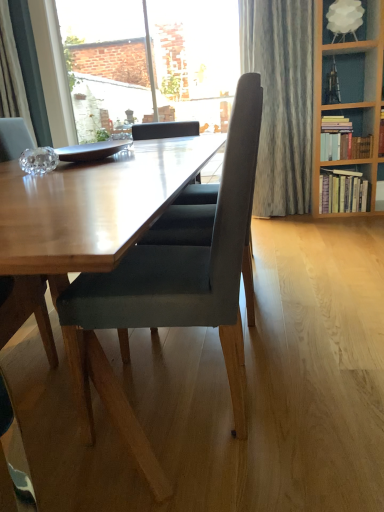
Question: From a real-world perspective, is velvet grey chair at center positioned over transparent glass window at upper center based on gravity?

Choices:
 (A) yes
 (B) no

Answer: (B)

Question: Can you confirm if velvet grey chair at center is thinner than transparent glass window at upper center?

Choices:
 (A) yes
 (B) no

Answer: (B)

Question: Does velvet grey chair at center come behind transparent glass window at upper center?

Choices:
 (A) yes
 (B) no

Answer: (B)

Question: Can you see velvet grey chair at center touching transparent glass window at upper center?

Choices:
 (A) no
 (B) yes

Answer: (A)

Question: Considering the relative sizes of velvet grey chair at center and transparent glass window at upper center in the image provided, is velvet grey chair at center bigger than transparent glass window at upper center?

Choices:
 (A) no
 (B) yes

Answer: (B)

Question: From the image's perspective, relative to velvet grey chair at center, is hardcover books at right, which is counted as the first book, starting from the bottom, above or below?

Choices:
 (A) below
 (B) above

Answer: (B)

Question: Considering their positions, is hardcover books at right, which is counted as the first book, starting from the bottom, located in front of or behind velvet grey chair at center?

Choices:
 (A) front
 (B) behind

Answer: (B)

Question: Is point (337, 205) positioned closer to the camera than point (187, 259)?

Choices:
 (A) farther
 (B) closer

Answer: (A)

Question: Is hardcover books at right, which appears as the 2th book when viewed from the top, bigger or smaller than velvet grey chair at center?

Choices:
 (A) small
 (B) big

Answer: (A)

Question: From a real-world perspective, is hardcover books at right, which is counted as the first book, starting from the bottom, physically located above or below wooden table at center?

Choices:
 (A) above
 (B) below

Answer: (A)

Question: Considering the relative positions of hardcover books at right, which is counted as the first book, starting from the bottom, and wooden table at center in the image provided, is hardcover books at right, which is counted as the first book, starting from the bottom, to the left or to the right of wooden table at center?

Choices:
 (A) right
 (B) left

Answer: (A)

Question: Based on their sizes in the image, would you say hardcover books at right, which is counted as the first book, starting from the bottom, is bigger or smaller than wooden table at center?

Choices:
 (A) small
 (B) big

Answer: (A)

Question: Is hardcover books at right, which appears as the 2th book when viewed from the top, taller or shorter than wooden table at center?

Choices:
 (A) short
 (B) tall

Answer: (B)

Question: Choose the correct answer: Is wooden table at center inside hardcover books at right, which is counted as the first book, starting from the bottom, or outside it?

Choices:
 (A) outside
 (B) inside

Answer: (A)

Question: Looking at their shapes, would you say wooden table at center is wider or thinner than hardcover books at right, which is counted as the first book, starting from the bottom?

Choices:
 (A) thin
 (B) wide

Answer: (B)